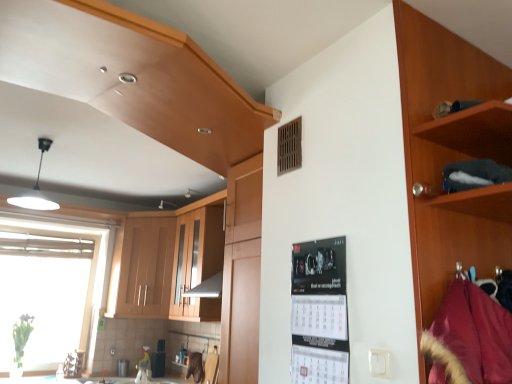
Question: From the image's perspective, is transparent glass window at left located beneath wooden cabinet at upper left, arranged as the third cabinetry when viewed from the front?

Choices:
 (A) yes
 (B) no

Answer: (A)

Question: From a real-world perspective, is transparent glass window at left on top of wooden cabinet at upper left, the first cabinetry from the back?

Choices:
 (A) no
 (B) yes

Answer: (A)

Question: From a real-world perspective, does transparent glass window at left sit lower than wooden cabinet at upper left, the first cabinetry from the back?

Choices:
 (A) yes
 (B) no

Answer: (A)

Question: Would you consider transparent glass window at left to be distant from wooden cabinet at upper left, the third cabinetry from the right?

Choices:
 (A) no
 (B) yes

Answer: (A)

Question: Is transparent glass window at left shorter than wooden cabinet at upper left, arranged as the third cabinetry when viewed from the front?

Choices:
 (A) no
 (B) yes

Answer: (A)

Question: Is transparent glass window at left with wooden cabinet at upper left, the first cabinetry from the back?

Choices:
 (A) no
 (B) yes

Answer: (A)

Question: Is velvet burgundy coat at right thinner than wooden cabinet at right, which is the third cabinetry in back-to-front order?

Choices:
 (A) no
 (B) yes

Answer: (B)

Question: Does velvet burgundy coat at right have a greater height compared to wooden cabinet at right, which is the third cabinetry in back-to-front order?

Choices:
 (A) no
 (B) yes

Answer: (A)

Question: Is velvet burgundy coat at right wider than wooden cabinet at right, which is the third cabinetry in back-to-front order?

Choices:
 (A) yes
 (B) no

Answer: (B)

Question: Is velvet burgundy coat at right outside wooden cabinet at right, which is the third cabinetry in back-to-front order?

Choices:
 (A) no
 (B) yes

Answer: (A)

Question: Can wooden cabinet at right, which ranks as the third cabinetry in left-to-right order, be found inside velvet burgundy coat at right?

Choices:
 (A) no
 (B) yes

Answer: (A)

Question: Does velvet burgundy coat at right appear on the left side of wooden cabinet at right, which ranks as the third cabinetry in left-to-right order?

Choices:
 (A) no
 (B) yes

Answer: (B)

Question: Can you confirm if white glossy countertop at lower center is wider than transparent glass window at left?

Choices:
 (A) yes
 (B) no

Answer: (A)